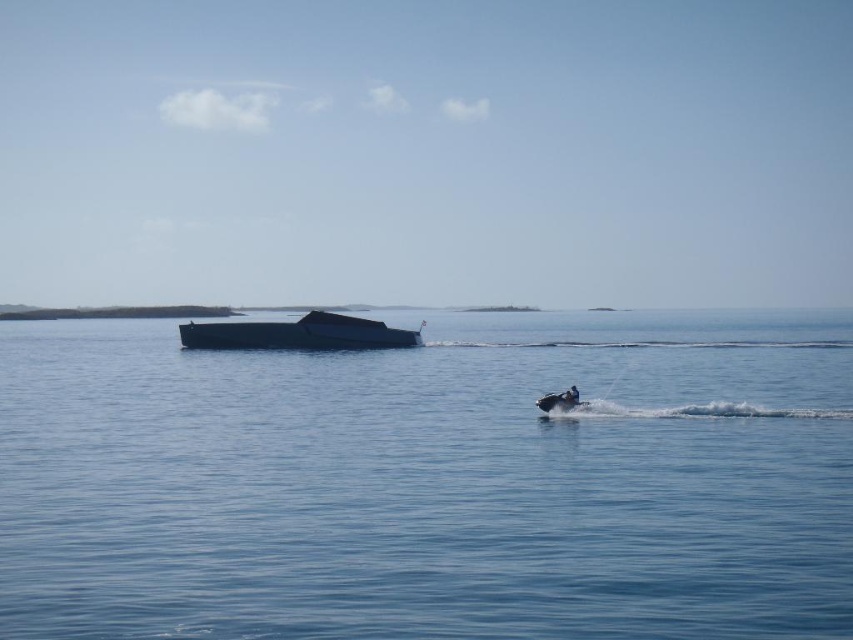
You are a sailor on the shiny black boat at center. You notice a dark blue fabric person at lower right. Where is this person located relative to your boat?

The dark blue fabric person at lower right is behind the shiny black boat at center, so the person is located behind your boat.

You are on a boat navigating through the water and see two points marked on your map. The first point is at point [697,524] and the second is at point [560,397]. Which point should you steer towards if you want to reach the one that is closer to your current position?

Point [697,524] is in front of point [560,397], so you should steer towards point [697,524] since it is closer to your current position.

You are a sailor on a ship that is 10 meters long. You see the shiny black boat at center and the dark blue fabric person at lower right in the water. Can your ship pass between them without touching either?

The distance between the shiny black boat at center and the dark blue fabric person at lower right is 22.68 meters. Since your ship is 10 meters long, there is enough space to pass between them without touching either.